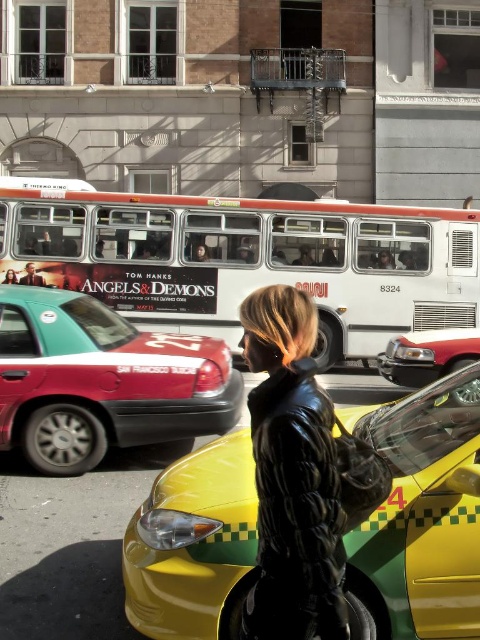
You are standing at the point marked as point (420, 516). What is the nearest object to you in the scene?

The yellow matte taxi at center is located at point (420, 516), so it is the nearest object to you.

You are standing at the point marked by the coordinate point at (x=171, y=476). You want to walk towards the yellow taxi with green and black checkerboard doors. How far will you have to walk to reach the yellow taxi with green and black checkerboard doors?

The point at (x=171, y=476) is 3.44 meters from the viewer. Therefore, you will have to walk 3.44 meters to reach the yellow taxi with green and black checkerboard doors.

You are a pedestrian trying to cross the street and see the yellow matte taxi at center and the teal glossy taxi at left. Which taxi is closer to you?

The yellow matte taxi at center is closer to you because it is shorter than the teal glossy taxi at left, which means it is positioned in front of the taller teal taxi.